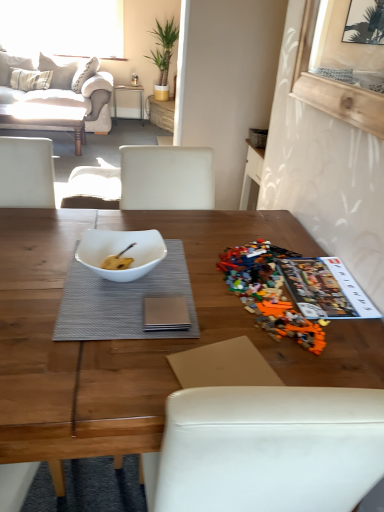
Question: Is matte white coffee table at upper left, which is the second coffee table from right to left, shorter than white glossy bowl at center?

Choices:
 (A) no
 (B) yes

Answer: (A)

Question: Does matte white coffee table at upper left, which ranks as the 1th coffee table in left-to-right order, come in front of white glossy bowl at center?

Choices:
 (A) no
 (B) yes

Answer: (A)

Question: From the image's perspective, is matte white coffee table at upper left, which ranks as the 2th coffee table in bottom-to-top order, below white glossy bowl at center?

Choices:
 (A) no
 (B) yes

Answer: (A)

Question: From a real-world perspective, is matte white coffee table at upper left, which is the second coffee table from right to left, under white glossy bowl at center?

Choices:
 (A) yes
 (B) no

Answer: (A)

Question: Is matte white coffee table at upper left, which is the first coffee table in back-to-front order, to the left of white glossy bowl at center from the viewer's perspective?

Choices:
 (A) yes
 (B) no

Answer: (A)

Question: Considering the positions of point (140, 90) and point (150, 271), is point (140, 90) closer or farther from the camera than point (150, 271)?

Choices:
 (A) farther
 (B) closer

Answer: (A)

Question: From their relative heights in the image, would you say metallic silver table at center is taller or shorter than gray textured placemat at center?

Choices:
 (A) short
 (B) tall

Answer: (B)

Question: Is metallic silver table at center wider or thinner than gray textured placemat at center?

Choices:
 (A) thin
 (B) wide

Answer: (B)

Question: From the image's perspective, is metallic silver table at center above or below gray textured placemat at center?

Choices:
 (A) above
 (B) below

Answer: (A)

Question: Is multicolored plastic lego set at right wider or thinner than transparent glass window at upper center?

Choices:
 (A) wide
 (B) thin

Answer: (A)

Question: From a real-world perspective, relative to transparent glass window at upper center, is multicolored plastic lego set at right vertically above or below?

Choices:
 (A) below
 (B) above

Answer: (A)

Question: Looking at the image, does multicolored plastic lego set at right seem bigger or smaller compared to transparent glass window at upper center?

Choices:
 (A) big
 (B) small

Answer: (B)

Question: From the image's perspective, is multicolored plastic lego set at right located above or below transparent glass window at upper center?

Choices:
 (A) above
 (B) below

Answer: (B)

Question: From the image's perspective, relative to matte white coffee table at upper left, which is the first coffee table in top-to-bottom order, is transparent glass window at upper center above or below?

Choices:
 (A) above
 (B) below

Answer: (A)

Question: Looking at their shapes, would you say transparent glass window at upper center is wider or thinner than matte white coffee table at upper left, which ranks as the 2th coffee table in bottom-to-top order?

Choices:
 (A) thin
 (B) wide

Answer: (A)